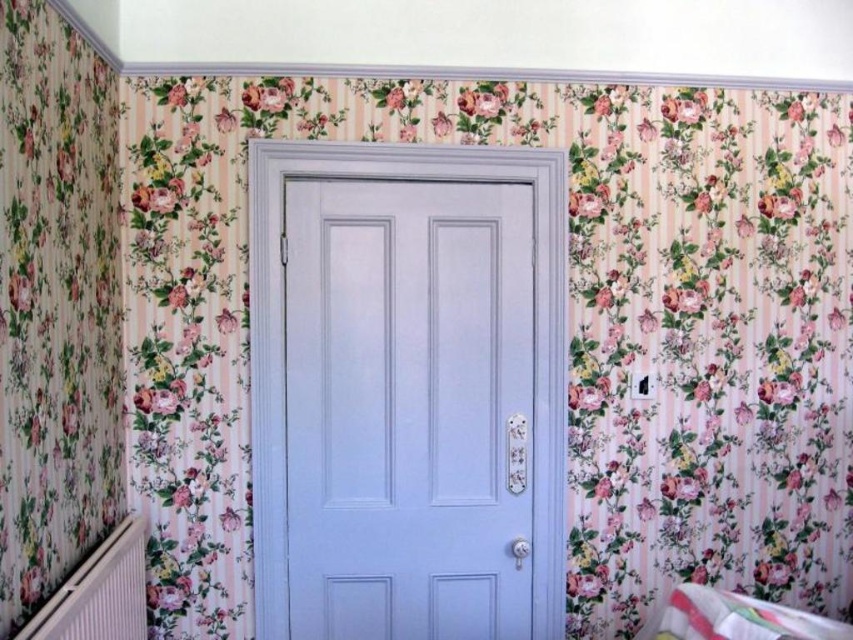
Which is in front, point (294, 376) or point (701, 616)?

Positioned in front is point (701, 616).

Can you confirm if matte white door at center is bigger than multicolored fabric infant bed at lower right?

Correct, matte white door at center is larger in size than multicolored fabric infant bed at lower right.

Who is more distant from viewer, (337, 481) or (721, 609)?

Point (337, 481)

Identify the location of matte white door at center. The width and height of the screenshot is (853, 640). (408, 406).